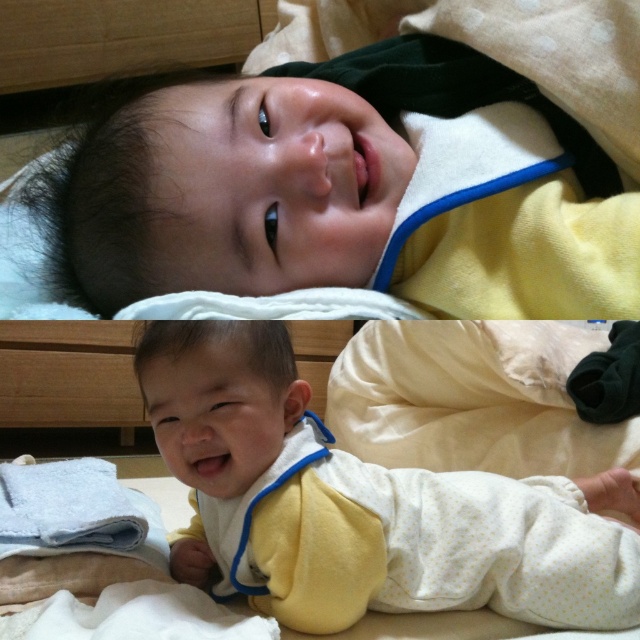
Between yellow fleece baby at upper center and yellow dotted fabric at center, which one is positioned lower?

yellow dotted fabric at center is below.

Is yellow fleece baby at upper center positioned in front of yellow dotted fabric at center?

Yes, yellow fleece baby at upper center is closer to the viewer.

What do you see at coordinates (340, 189) in the screenshot? The width and height of the screenshot is (640, 640). I see `yellow fleece baby at upper center` at bounding box center [340, 189].

At what (x,y) coordinates should I click in order to perform the action: click on yellow fleece baby at upper center. Please return your answer as a coordinate pair (x, y). Image resolution: width=640 pixels, height=640 pixels. Looking at the image, I should click on (340, 189).